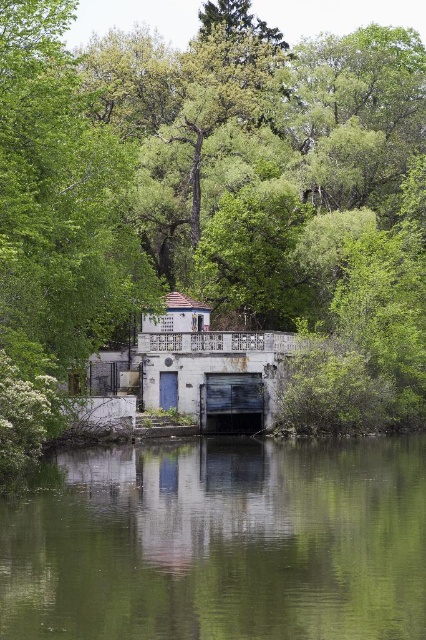
Can you confirm if green leafy tree at center is wider than green reflective water at center?

Indeed, green leafy tree at center has a greater width compared to green reflective water at center.

Does green leafy tree at center come in front of green reflective water at center?

No, green leafy tree at center is further to the viewer.

Which is behind, point (6, 292) or point (406, 572)?

The point (6, 292) is behind.

The width and height of the screenshot is (426, 640). Find the location of `green leafy tree at center`. green leafy tree at center is located at coordinates (203, 177).